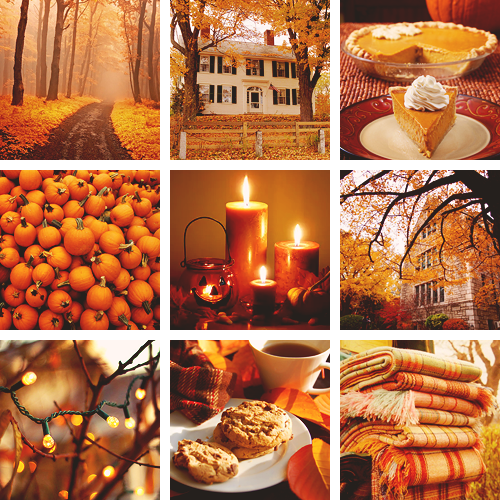
Where is `towels`? towels is located at coordinates (421, 359), (435, 389), (442, 403), (441, 420), (439, 435), (434, 465).